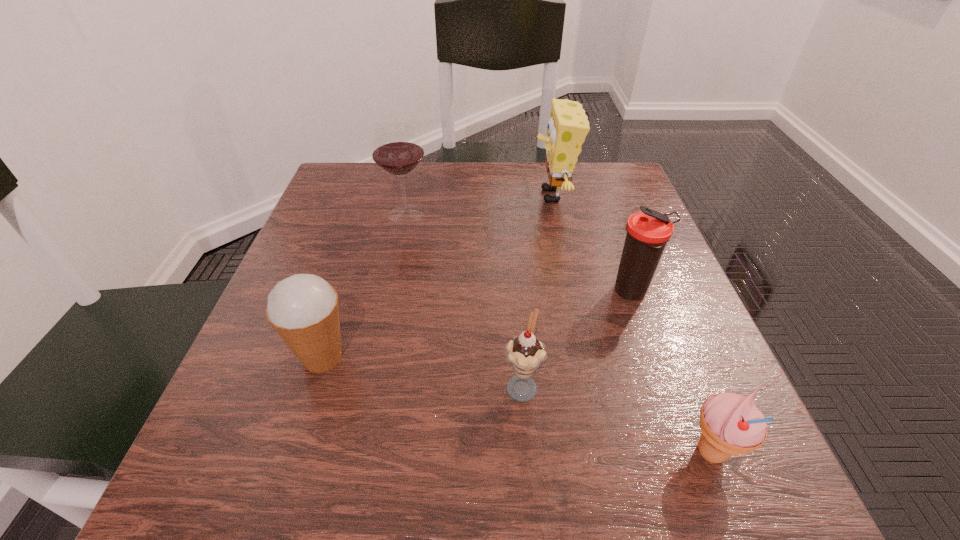
This screenshot has width=960, height=540. I want to click on vacant region between the fourth object from right to left and the sponge, so click(537, 289).

Where is `free space between the wineglass and the third farthest object`? The height and width of the screenshot is (540, 960). free space between the wineglass and the third farthest object is located at coordinates (519, 253).

The height and width of the screenshot is (540, 960). I want to click on free area in between the third farthest object and the wineglass, so click(x=519, y=253).

Where is `free space between the second icecream from left to right and the wineglass`? free space between the second icecream from left to right and the wineglass is located at coordinates (464, 299).

Identify which object is located as the fourth nearest to the nearest object. Please provide its 2D coordinates. Your answer should be formatted as a tuple, i.e. [(x, y)], where the tuple contains the x and y coordinates of a point satisfying the conditions above.

[(303, 309)]

Find the location of a particular element. This screenshot has height=540, width=960. the second closest object to the thermos bottle is located at coordinates (525, 353).

You are a GUI agent. You are given a task and a screenshot of the screen. Output one action in this format:
    pyautogui.click(x=<x>, y=<y>)
    Task: Click on the icecream that is the third nearest to the wineglass
    Image resolution: width=960 pixels, height=540 pixels.
    Given the screenshot: What is the action you would take?
    pyautogui.click(x=731, y=424)

Image resolution: width=960 pixels, height=540 pixels. I want to click on icecream that is the second closest to the second icecream from left to right, so click(303, 309).

What are the coordinates of `vacant space that satisfies the following two spatial constraints: 1. on the face of the third object from right to left; 2. on the right side of the rightmost icecream` in the screenshot? It's located at (609, 453).

Locate an element on the screen. The height and width of the screenshot is (540, 960). vacant space that satisfies the following two spatial constraints: 1. on the face of the sponge; 2. on the right side of the nearest icecream is located at coordinates (609, 453).